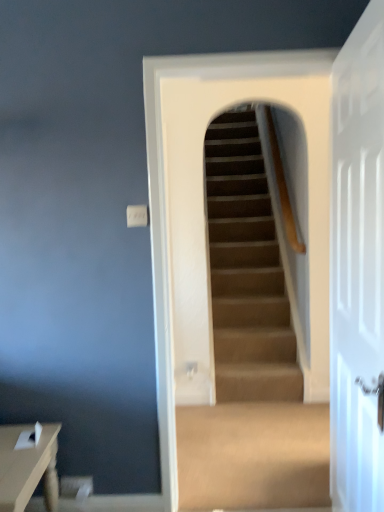
Question: From a real-world perspective, relative to white glossy door at right, is matte brown table at lower left vertically above or below?

Choices:
 (A) above
 (B) below

Answer: (B)

Question: In the image, is matte brown table at lower left positioned in front of or behind white glossy door at right?

Choices:
 (A) front
 (B) behind

Answer: (B)

Question: Estimate the real-world distances between objects in this image. Which object is closer to the matte brown table at lower left?

Choices:
 (A) carpeted stairs at center
 (B) white glossy door at right

Answer: (B)

Question: Estimate the real-world distances between objects in this image. Which object is closer to the matte brown table at lower left?

Choices:
 (A) white glossy door at right
 (B) carpeted stairs at center

Answer: (A)